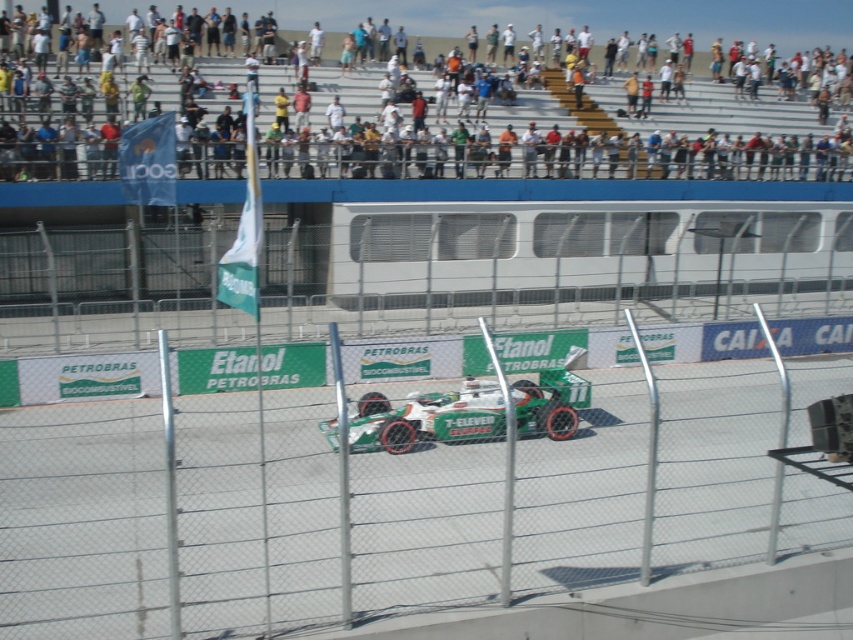
Which is more to the right, green racing car at center or green matte race car at center?

green racing car at center

Does green racing car at center have a smaller size compared to green matte race car at center?

Incorrect, green racing car at center is not smaller in size than green matte race car at center.

Is point (53, 129) positioned after point (370, 400)?

Yes.

In order to click on green racing car at center in this screenshot , I will do `click(590, 145)`.

Is metal chain-link fence at center thinner than green matte race car at center?

No.

Is metal chain-link fence at center in front of green matte race car at center?

Yes.

Between point (648, 506) and point (491, 429), which one is positioned in front?

Point (648, 506) is more forward.

Locate an element on the screen. The image size is (853, 640). metal chain-link fence at center is located at coordinates pos(409,477).

You are a GUI agent. You are given a task and a screenshot of the screen. Output one action in this format:
    pyautogui.click(x=<x>, y=<y>)
    Task: Click on the metal chain-link fence at center
    
    Given the screenshot: What is the action you would take?
    pyautogui.click(x=409, y=477)

What do you see at coordinates (409, 477) in the screenshot?
I see `metal chain-link fence at center` at bounding box center [409, 477].

Image resolution: width=853 pixels, height=640 pixels. Identify the location of metal chain-link fence at center. (409, 477).